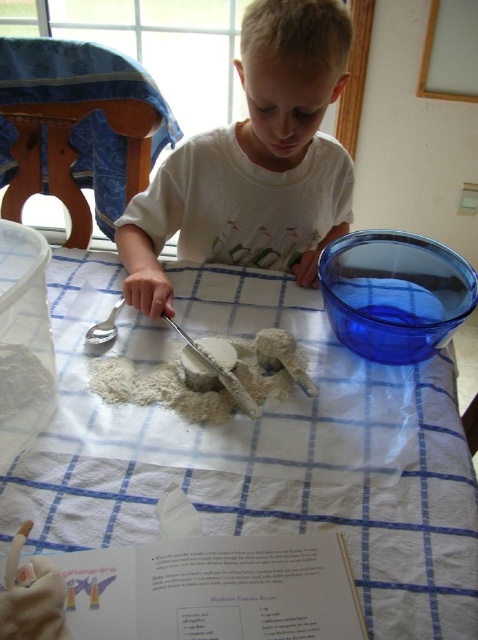
Question: Based on their relative distances, which object is nearer to the transparent plastic bowl at upper right?

Choices:
 (A) white matte dough at center
 (B) white paper towel at center
 (C) white matte shirt at upper center

Answer: (B)

Question: Which of the following is the farthest from the observer?

Choices:
 (A) white paper towel at center
 (B) transparent plastic bowl at upper right
 (C) white matte shirt at upper center

Answer: (C)

Question: Considering the relative positions of white paper towel at center and transparent plastic bowl at upper right in the image provided, where is white paper towel at center located with respect to transparent plastic bowl at upper right?

Choices:
 (A) below
 (B) above

Answer: (A)

Question: In this image, where is white matte shirt at upper center located relative to transparent plastic bowl at upper right?

Choices:
 (A) right
 (B) left

Answer: (B)

Question: Among these objects, which one is farthest from the camera?

Choices:
 (A) transparent plastic bowl at upper right
 (B) white matte dough at center
 (C) white paper towel at center

Answer: (A)

Question: Does white paper towel at center appear on the right side of transparent plastic bowl at upper right?

Choices:
 (A) no
 (B) yes

Answer: (A)